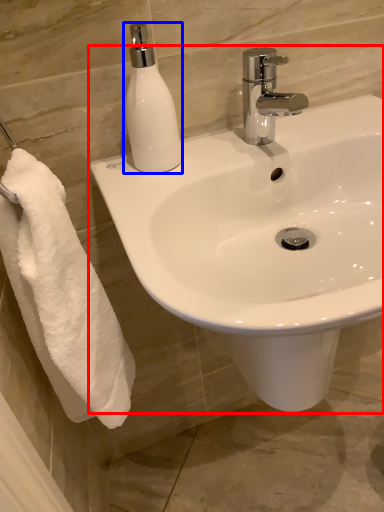
Question: Which object appears farthest to the camera in this image, sink (highlighted by a red box) or soap dispenser (highlighted by a blue box)?

Choices:
 (A) sink
 (B) soap dispenser

Answer: (B)